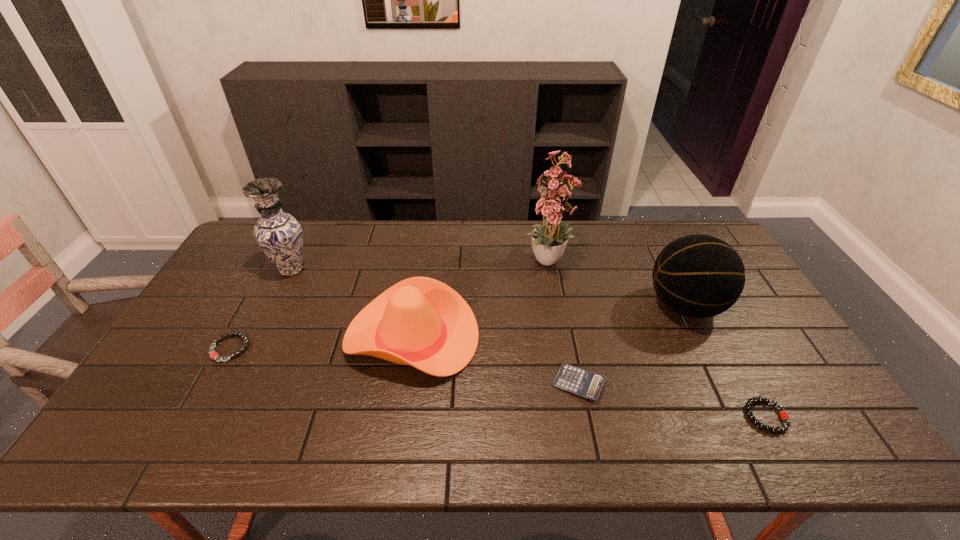
This screenshot has height=540, width=960. I want to click on vacant region that satisfies the following two spatial constraints: 1. on the front side of the basketball; 2. on the right side of the sixth shortest object, so click(274, 306).

Find the location of a particular element. vacant space that satisfies the following two spatial constraints: 1. on the front side of the nearer bracelet; 2. on the right side of the fourth tallest object is located at coordinates (399, 416).

This screenshot has height=540, width=960. I want to click on vacant point that satisfies the following two spatial constraints: 1. on the front-facing side of the flower arrangement; 2. on the left side of the right bracelet, so click(579, 416).

The width and height of the screenshot is (960, 540). In order to click on free space that satisfies the following two spatial constraints: 1. on the back side of the basketball; 2. on the left side of the fourth shortest object in this screenshot , I will do `click(417, 306)`.

Find the location of `blank space that satisfies the following two spatial constraints: 1. on the front-facing side of the tallest object; 2. on the left side of the nearer bracelet`. blank space that satisfies the following two spatial constraints: 1. on the front-facing side of the tallest object; 2. on the left side of the nearer bracelet is located at coordinates (579, 416).

What are the coordinates of `vacant position in the image that satisfies the following two spatial constraints: 1. on the front side of the cowboy hat; 2. on the left side of the calculator` in the screenshot? It's located at (405, 383).